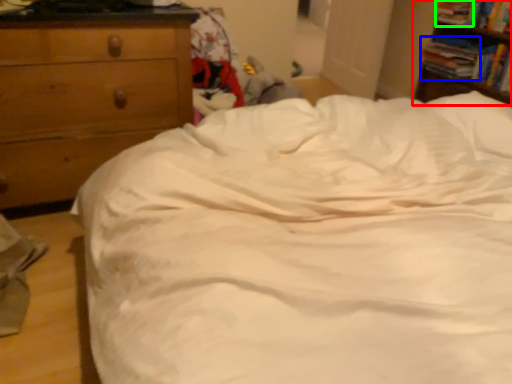
Question: Which object is positioned farthest from nightstand (highlighted by a red box)? Select from book (highlighted by a blue box) and book (highlighted by a green box).

Choices:
 (A) book
 (B) book

Answer: (B)